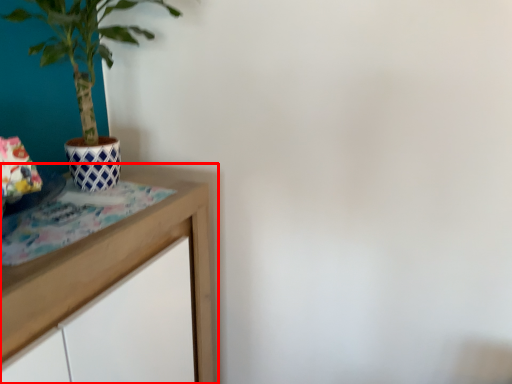
Question: From the image's perspective, where is table (annotated by the red box) located relative to houseplant?

Choices:
 (A) above
 (B) below

Answer: (B)